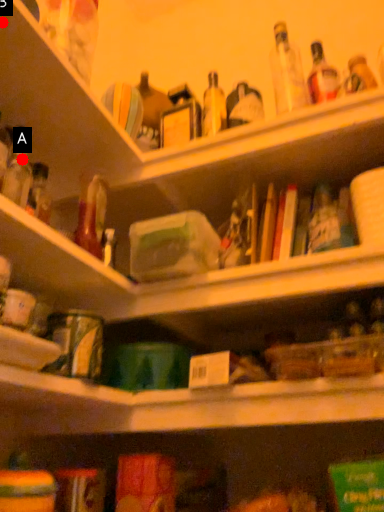
Question: Two points are circled on the image, labeled by A and B beside each circle. Among these points, which one is farthest from the camera?

Choices:
 (A) A is further
 (B) B is further

Answer: (A)